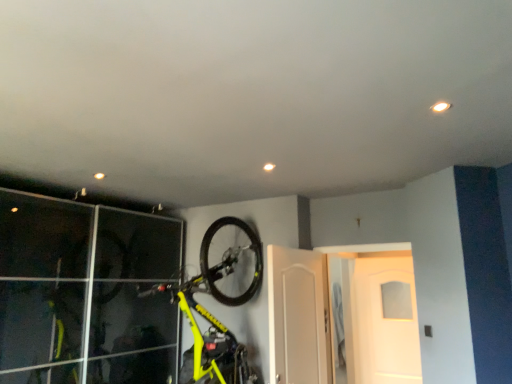
Question: Is white glossy door at center, the third door when ordered from front to back, taller than white glossy door at center, the second door viewed from the front?

Choices:
 (A) no
 (B) yes

Answer: (B)

Question: Does white glossy door at center, which is the 1th door in back-to-front order, come behind white glossy door at center, arranged as the 2th door when viewed from the back?

Choices:
 (A) no
 (B) yes

Answer: (B)

Question: Is white glossy door at center, arranged as the 2th door when viewed from the back, at the back of white glossy door at center, which is the 1th door in back-to-front order?

Choices:
 (A) no
 (B) yes

Answer: (A)

Question: Can you confirm if white glossy door at center, which is the 1th door in back-to-front order, is smaller than white glossy door at center, the second door viewed from the front?

Choices:
 (A) no
 (B) yes

Answer: (B)

Question: From a real-world perspective, is white glossy door at center, which is the 1th door in back-to-front order, physically below white glossy door at center, arranged as the 2th door when viewed from the back?

Choices:
 (A) no
 (B) yes

Answer: (B)

Question: From a real-world perspective, is white matte door at center, placed as the 1th door when sorted from front to back, physically located above or below yellow matte bicycle at upper center?

Choices:
 (A) below
 (B) above

Answer: (A)

Question: In terms of width, does white matte door at center, placed as the 1th door when sorted from front to back, look wider or thinner when compared to yellow matte bicycle at upper center?

Choices:
 (A) wide
 (B) thin

Answer: (B)

Question: Considering the positions of point (325, 367) and point (234, 286), is point (325, 367) closer or farther from the camera than point (234, 286)?

Choices:
 (A) closer
 (B) farther

Answer: (B)

Question: Based on their positions, is white matte door at center, the 3th door in the back-to-front sequence, located to the left or right of yellow matte bicycle at upper center?

Choices:
 (A) left
 (B) right

Answer: (B)

Question: Would you say white glossy door at center, the third door when ordered from front to back, is inside or outside white glossy door at center, arranged as the 2th door when viewed from the back?

Choices:
 (A) outside
 (B) inside

Answer: (A)

Question: From a real-world perspective, relative to white glossy door at center, arranged as the 2th door when viewed from the back, is white glossy door at center, which is the 1th door in back-to-front order, vertically above or below?

Choices:
 (A) above
 (B) below

Answer: (B)

Question: Considering the positions of point (332, 329) and point (345, 302), is point (332, 329) closer or farther from the camera than point (345, 302)?

Choices:
 (A) closer
 (B) farther

Answer: (A)

Question: In the image, is white glossy door at center, the third door when ordered from front to back, positioned in front of or behind white glossy door at center, arranged as the 2th door when viewed from the back?

Choices:
 (A) behind
 (B) front

Answer: (A)

Question: Considering their positions, is white matte door at center, placed as the 1th door when sorted from front to back, located in front of or behind white glossy door at center, the second door viewed from the front?

Choices:
 (A) behind
 (B) front

Answer: (B)

Question: From a real-world perspective, relative to white glossy door at center, the second door viewed from the front, is white matte door at center, placed as the 1th door when sorted from front to back, vertically above or below?

Choices:
 (A) above
 (B) below

Answer: (B)